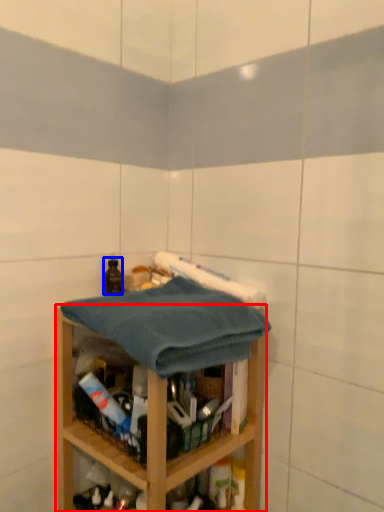
Question: Which point is closer to the camera, shelf (highlighted by a red box) or bottle (highlighted by a blue box)?

Choices:
 (A) shelf
 (B) bottle

Answer: (A)